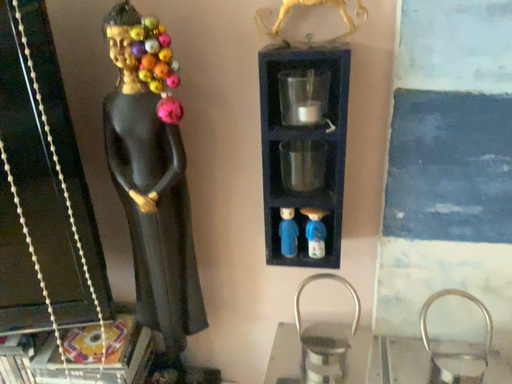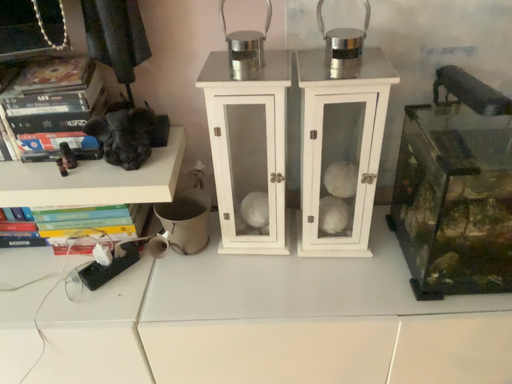
Question: How did the camera likely rotate when shooting the video?

Choices:
 (A) rotated downward
 (B) rotated upward

Answer: (A)